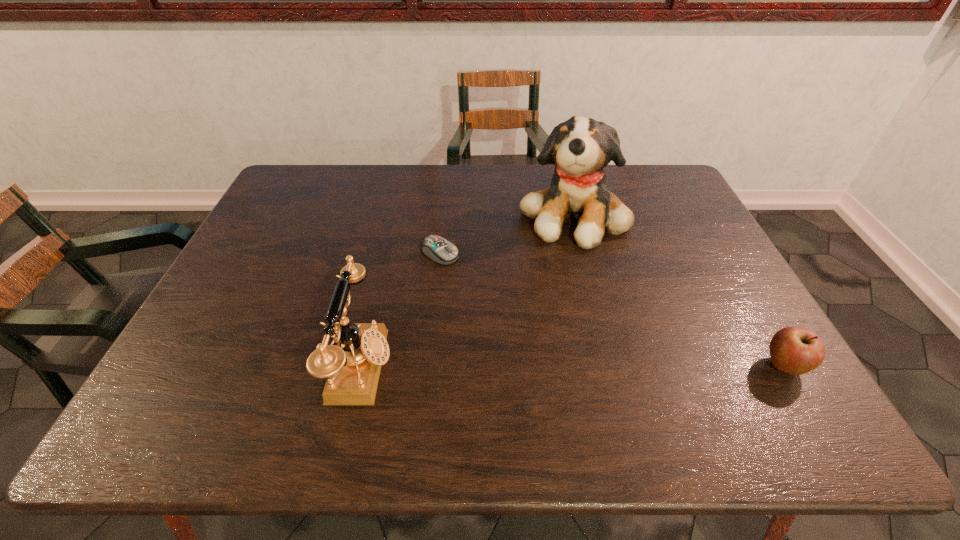
At what (x,y) coordinates should I click in order to perform the action: click on vacant region located 0.050m at the face of the third object from left to right. Please return your answer as a coordinate pair (x, y). Image resolution: width=960 pixels, height=540 pixels. Looking at the image, I should click on (580, 264).

This screenshot has width=960, height=540. What are the coordinates of `free location located at the face of the third object from left to right` in the screenshot? It's located at (588, 325).

The image size is (960, 540). What are the coordinates of `blank space located at the face of the third object from left to right` in the screenshot? It's located at tap(580, 266).

This screenshot has height=540, width=960. I want to click on blank space located 0.160m on the wheel side of the shortest object, so click(x=500, y=288).

The height and width of the screenshot is (540, 960). What are the coordinates of `vacant space located on the wheel side of the shortest object` in the screenshot? It's located at (573, 330).

This screenshot has height=540, width=960. What are the coordinates of `free space located on the wheel side of the shortest object` in the screenshot? It's located at (476, 274).

Find the location of a particular element. The height and width of the screenshot is (540, 960). object positioned at the far edge is located at coordinates 580,148.

This screenshot has height=540, width=960. In order to click on telephone situated at the near edge in this screenshot , I will do tap(352, 368).

This screenshot has width=960, height=540. What are the coordinates of `apple located at the near edge` in the screenshot? It's located at (793, 350).

At what (x,y) coordinates should I click in order to perform the action: click on object that is at the right edge. Please return your answer as a coordinate pair (x, y). This screenshot has width=960, height=540. Looking at the image, I should click on (x=793, y=350).